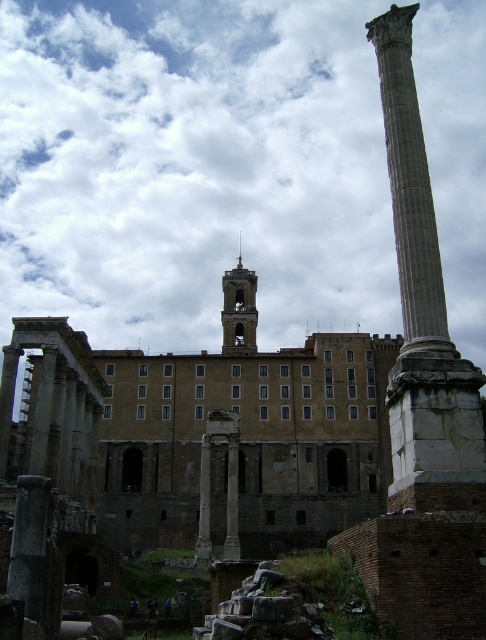
Between gray stone column at right and smooth stone tower at center, which one appears on the left side from the viewer's perspective?

Positioned to the left is smooth stone tower at center.

The height and width of the screenshot is (640, 486). Identify the location of gray stone column at right. (421, 292).

Where is `gray stone column at right`? The image size is (486, 640). gray stone column at right is located at coordinates (421, 292).